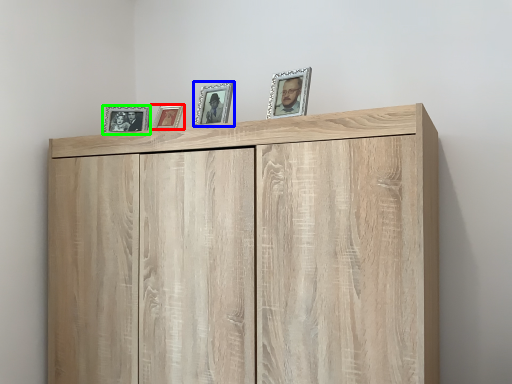
Question: Estimate the real-world distances between objects in this image. Which object is farther from picture frame (highlighted by a red box), picture frame (highlighted by a blue box) or picture frame (highlighted by a green box)?

Choices:
 (A) picture frame
 (B) picture frame

Answer: (A)